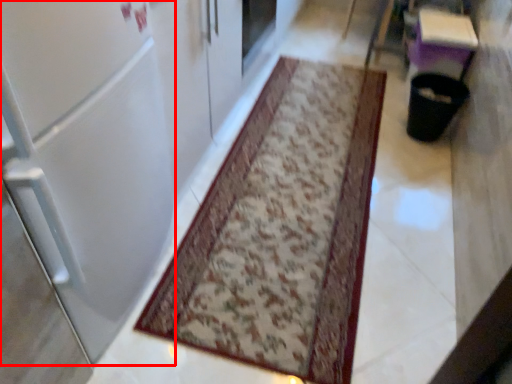
Question: From the image's perspective, considering the relative positions of door (annotated by the red box) and mat in the image provided, where is door (annotated by the red box) located with respect to the staircase?

Choices:
 (A) below
 (B) above

Answer: (B)